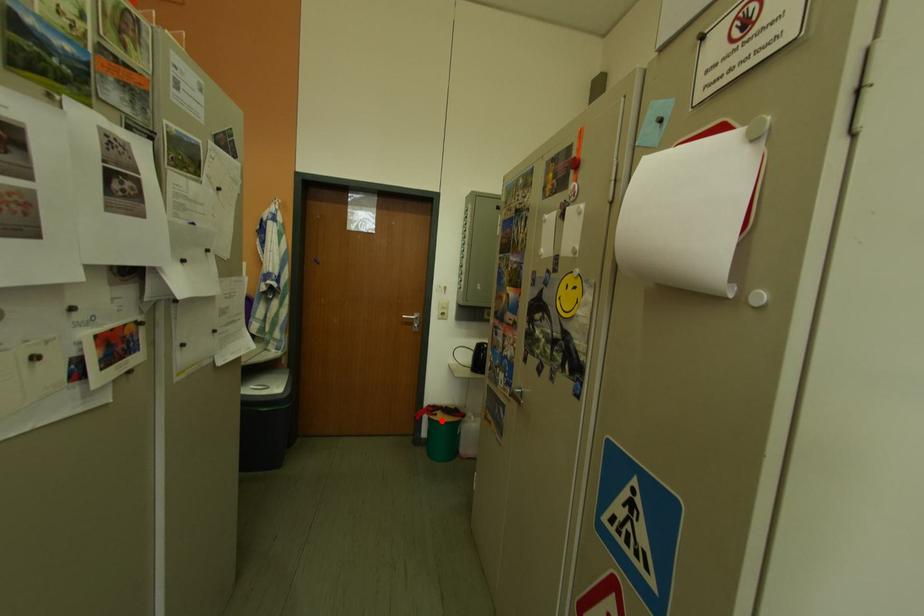
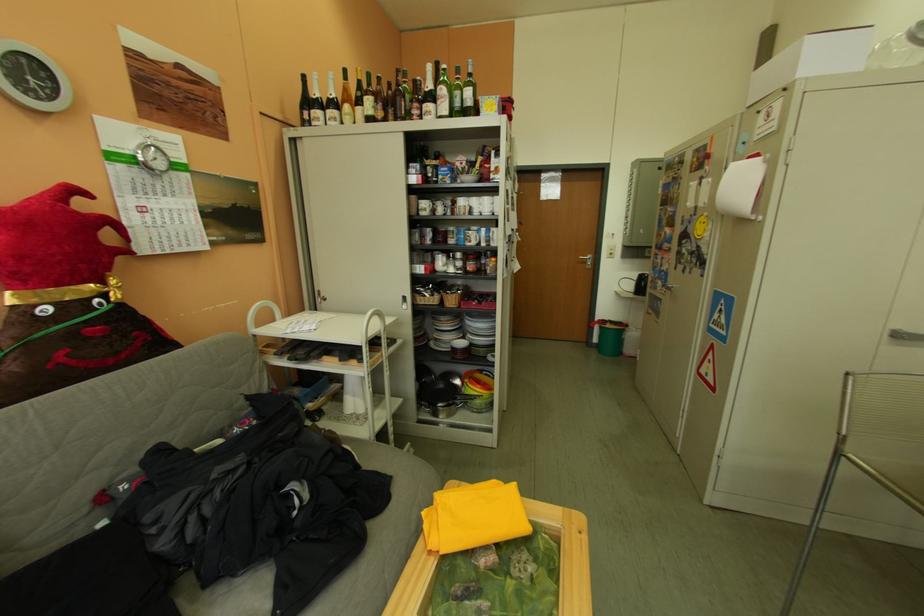
Question: I am providing you with two images of the same scene from different viewpoints. A red point is shown in image1. For the corresponding object point in image2, is it positioned nearer or farther from the camera?

Choices:
 (A) Nearer
 (B) Farther

Answer: (A)